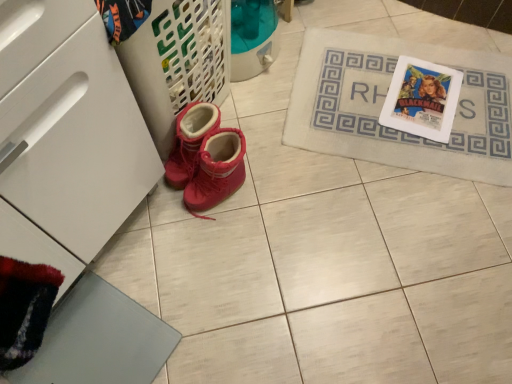
Question: Can you confirm if white matte drawer at lower left is bigger than beige fabric bath mat at upper right?

Choices:
 (A) yes
 (B) no

Answer: (A)

Question: Is white matte drawer at lower left in front of beige fabric bath mat at upper right?

Choices:
 (A) no
 (B) yes

Answer: (B)

Question: Is white matte drawer at lower left taller than beige fabric bath mat at upper right?

Choices:
 (A) yes
 (B) no

Answer: (A)

Question: Considering the relative sizes of white matte drawer at lower left and beige fabric bath mat at upper right in the image provided, is white matte drawer at lower left wider than beige fabric bath mat at upper right?

Choices:
 (A) no
 (B) yes

Answer: (A)

Question: Can you confirm if white matte drawer at lower left is shorter than beige fabric bath mat at upper right?

Choices:
 (A) yes
 (B) no

Answer: (B)

Question: From the image's perspective, is suede-like red boots at lower left positioned above or below beige fabric bath mat at upper right?

Choices:
 (A) above
 (B) below

Answer: (B)

Question: Is point (179, 117) closer or farther from the camera than point (494, 92)?

Choices:
 (A) farther
 (B) closer

Answer: (B)

Question: In the image, is suede-like red boots at lower left positioned in front of or behind beige fabric bath mat at upper right?

Choices:
 (A) behind
 (B) front

Answer: (B)

Question: In terms of size, does suede-like red boots at lower left appear bigger or smaller than beige fabric bath mat at upper right?

Choices:
 (A) big
 (B) small

Answer: (B)

Question: In the image, is beige fabric bath mat at upper right positioned in front of or behind white matte drawer at lower left?

Choices:
 (A) front
 (B) behind

Answer: (B)

Question: Is beige fabric bath mat at upper right wider or thinner than white matte drawer at lower left?

Choices:
 (A) wide
 (B) thin

Answer: (A)

Question: Does point (339, 125) appear closer or farther from the camera than point (41, 61)?

Choices:
 (A) closer
 (B) farther

Answer: (B)

Question: Is beige fabric bath mat at upper right to the left or to the right of white matte drawer at lower left in the image?

Choices:
 (A) right
 (B) left

Answer: (A)

Question: From a real-world perspective, is white matte drawer at lower left positioned above or below suede-like red boots at lower left?

Choices:
 (A) below
 (B) above

Answer: (B)

Question: Considering their positions, is white matte drawer at lower left located in front of or behind suede-like red boots at lower left?

Choices:
 (A) behind
 (B) front

Answer: (B)